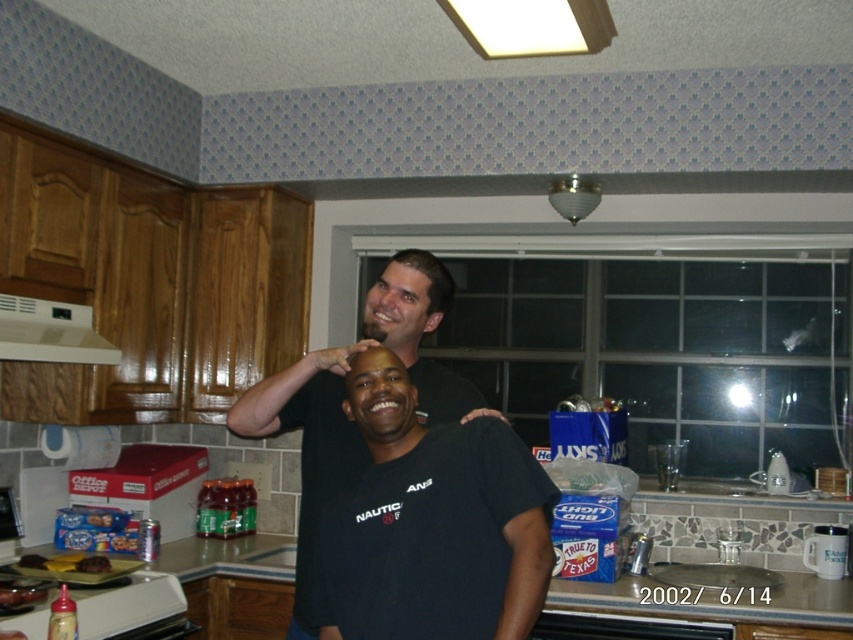
Question: Can you confirm if matte black head at upper center is bigger than translucent plastic bottles at lower left?

Choices:
 (A) no
 (B) yes

Answer: (B)

Question: Estimate the real-world distances between objects in this image. Which object is farther from the black matte head at center?

Choices:
 (A) black matte shirt at center
 (B) white matte exhaust hood at upper left
 (C) translucent plastic bottles at lower left
 (D) black cotton shirt at center

Answer: (C)

Question: Which point is closer to the camera?

Choices:
 (A) black matte shirt at center
 (B) matte black head at upper center
 (C) black cotton shirt at center

Answer: (C)

Question: Which of the following is the closest to the observer?

Choices:
 (A) (41, 312)
 (B) (352, 394)
 (C) (428, 285)
 (D) (387, 305)

Answer: (B)

Question: Is black matte shirt at center to the left of dark brown hair at upper center from the viewer's perspective?

Choices:
 (A) no
 (B) yes

Answer: (B)

Question: Is translucent plastic bottles at lower left to the left of dark brown hair at upper center from the viewer's perspective?

Choices:
 (A) yes
 (B) no

Answer: (A)